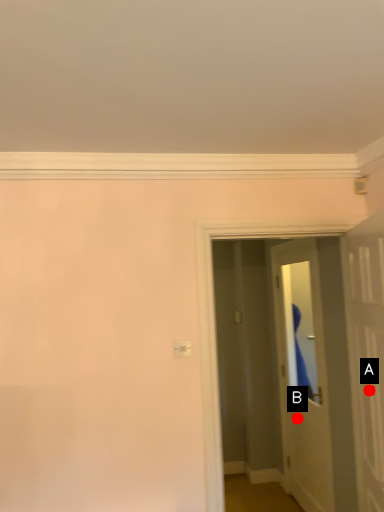
Question: Two points are circled on the image, labeled by A and B beside each circle. Which point appears farthest from the camera in this image?

Choices:
 (A) A is further
 (B) B is further

Answer: (B)